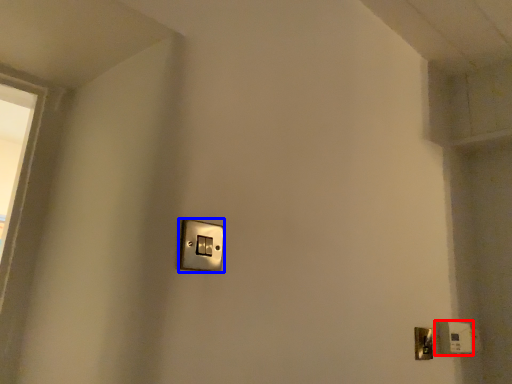
Question: Which object is further to the camera taking this photo, light switch (highlighted by a red box) or light switch (highlighted by a blue box)?

Choices:
 (A) light switch
 (B) light switch

Answer: (A)